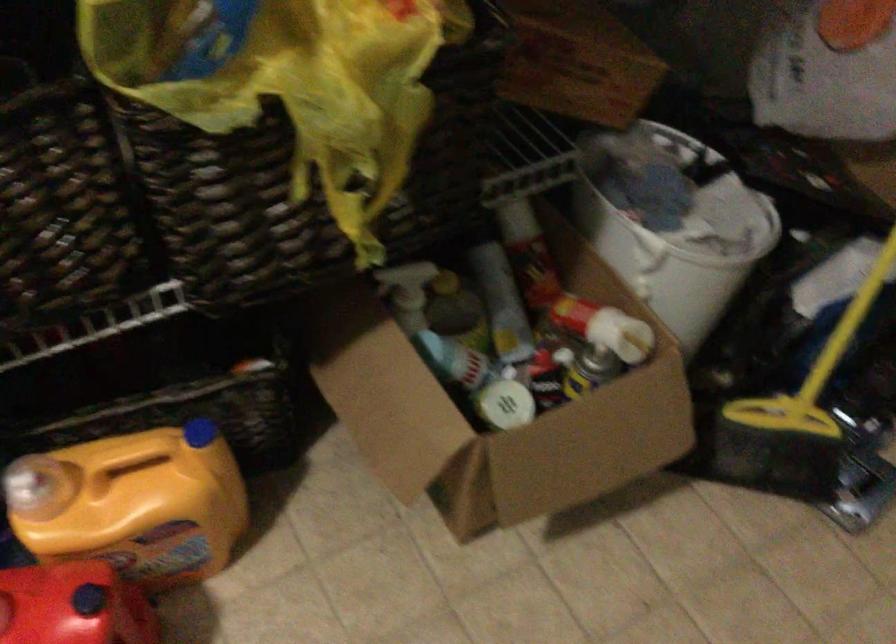
Locate an element on the screen. spray bottle trigger is located at coordinates (133, 504).